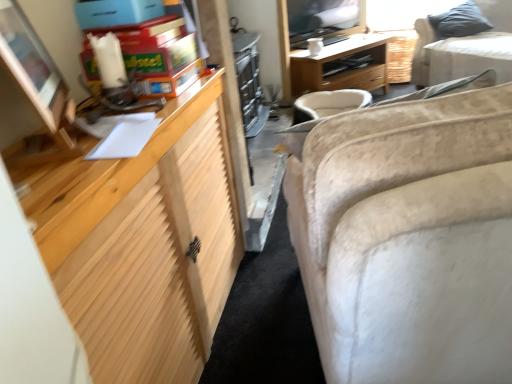
Question: Is beige fabric couch at upper right, the 2th studio couch from the front, wider or thinner than wooden desk at center?

Choices:
 (A) thin
 (B) wide

Answer: (A)

Question: Is beige fabric couch at upper right, which is the second studio couch in left-to-right order, spatially inside wooden desk at center, or outside of it?

Choices:
 (A) outside
 (B) inside

Answer: (A)

Question: Considering the real-world distances, which object is farthest from the matte wooden monitor at left?

Choices:
 (A) beige fabric couch at upper right, marked as the 2th studio couch in a bottom-to-top arrangement
 (B) wooden desk at center
 (C) beige fabric swivel chair at center
 (D) matte cardboard toy at upper left
 (E) beige fabric couch at right, which ranks as the second studio couch in top-to-bottom order

Answer: (A)

Question: Considering the real-world distances, which object is closest to the beige fabric couch at right, placed as the second studio couch when sorted from back to front?

Choices:
 (A) beige fabric swivel chair at center
 (B) gray fabric pillow at upper right
 (C) matte cardboard toy at upper left
 (D) beige fabric couch at upper right, positioned as the 1th studio couch in back-to-front order
 (E) wooden desk at center

Answer: (C)